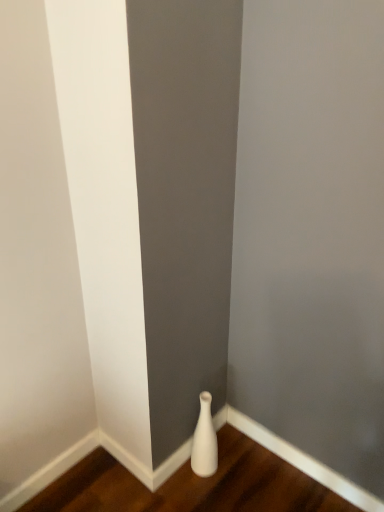
Question: Is white matte vase at lower right taller than shiny brown hardwood at lower center?

Choices:
 (A) yes
 (B) no

Answer: (A)

Question: Does white matte vase at lower right have a smaller size compared to shiny brown hardwood at lower center?

Choices:
 (A) yes
 (B) no

Answer: (A)

Question: Is the position of white matte vase at lower right more distant than that of shiny brown hardwood at lower center?

Choices:
 (A) yes
 (B) no

Answer: (A)

Question: Is shiny brown hardwood at lower center surrounded by white matte vase at lower right?

Choices:
 (A) no
 (B) yes

Answer: (A)

Question: Would you say white matte vase at lower right is outside shiny brown hardwood at lower center?

Choices:
 (A) no
 (B) yes

Answer: (B)

Question: Would you consider white matte vase at lower right to be distant from shiny brown hardwood at lower center?

Choices:
 (A) yes
 (B) no

Answer: (B)

Question: Can white matte vase at lower right be found inside shiny brown hardwood at lower center?

Choices:
 (A) yes
 (B) no

Answer: (B)

Question: Can you confirm if shiny brown hardwood at lower center is wider than white matte vase at lower right?

Choices:
 (A) yes
 (B) no

Answer: (A)

Question: From the image's perspective, is shiny brown hardwood at lower center located beneath white matte vase at lower right?

Choices:
 (A) yes
 (B) no

Answer: (A)

Question: Can you confirm if shiny brown hardwood at lower center is thinner than white matte vase at lower right?

Choices:
 (A) yes
 (B) no

Answer: (B)

Question: From a real-world perspective, is shiny brown hardwood at lower center on white matte vase at lower right?

Choices:
 (A) no
 (B) yes

Answer: (A)

Question: Considering the relative positions of shiny brown hardwood at lower center and white matte vase at lower right in the image provided, is shiny brown hardwood at lower center to the right of white matte vase at lower right from the viewer's perspective?

Choices:
 (A) yes
 (B) no

Answer: (B)

Question: From a real-world perspective, is shiny brown hardwood at lower center positioned above or below white matte vase at lower right?

Choices:
 (A) below
 (B) above

Answer: (A)